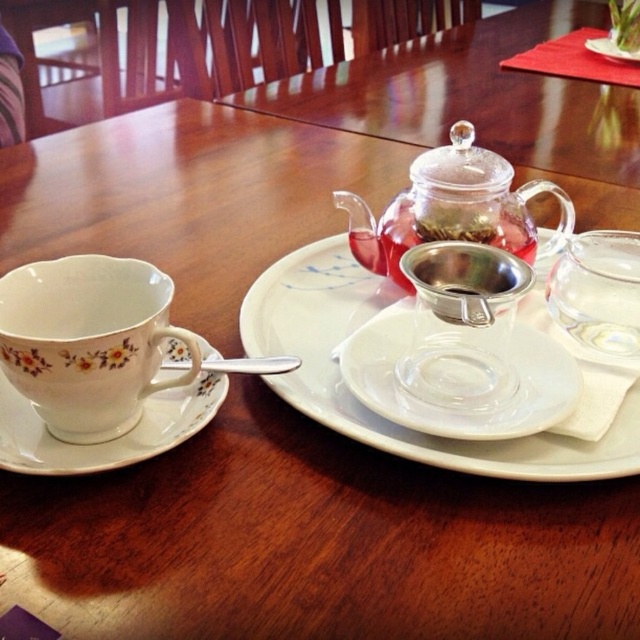
Question: Estimate the real-world distances between objects in this image. Which object is farther from the white ceramic saucer at left?

Choices:
 (A) porcelain floral teacup at left
 (B) transparent glass saucer at center
 (C) satin silver tea strainer at center
 (D) white porcelain platter at center

Answer: (C)

Question: Can you confirm if transparent glass teapot at center is positioned above satin silver tea strainer at center?

Choices:
 (A) no
 (B) yes

Answer: (B)

Question: From the image, what is the correct spatial relationship of transparent glass teapot at center in relation to white ceramic saucer at left?

Choices:
 (A) right
 (B) left

Answer: (A)

Question: Which of the following is the closest to the observer?

Choices:
 (A) (616, 264)
 (B) (497, 412)
 (C) (54, 385)
 (D) (636, 54)

Answer: (C)

Question: Which point is closer to the camera?

Choices:
 (A) transparent glass teapot at center
 (B) white ceramic plate at center
 (C) transparent glass saucer at center
 (D) white ceramic saucer at left

Answer: (D)

Question: Considering the relative positions of white ceramic saucer at left and satin silver tea strainer at center in the image provided, where is white ceramic saucer at left located with respect to satin silver tea strainer at center?

Choices:
 (A) left
 (B) right

Answer: (A)